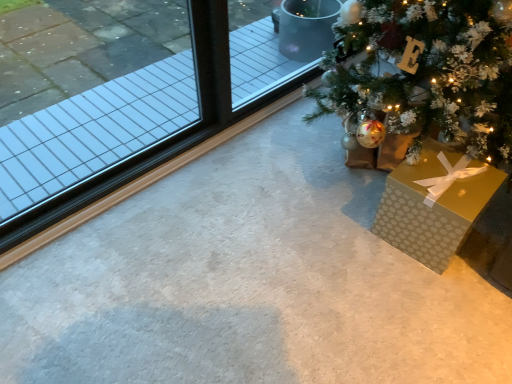
Question: Does clear glass window at left have a smaller size compared to gold paper gift at lower right?

Choices:
 (A) no
 (B) yes

Answer: (A)

Question: From a real-world perspective, is clear glass window at left under gold paper gift at lower right?

Choices:
 (A) yes
 (B) no

Answer: (B)

Question: Considering the relative positions of clear glass window at left and gold paper gift at lower right in the image provided, is clear glass window at left behind gold paper gift at lower right?

Choices:
 (A) no
 (B) yes

Answer: (A)

Question: Would you say clear glass window at left is a long distance from gold paper gift at lower right?

Choices:
 (A) yes
 (B) no

Answer: (A)

Question: Is clear glass window at left turned away from gold paper gift at lower right?

Choices:
 (A) no
 (B) yes

Answer: (A)

Question: Can you confirm if clear glass window at left is bigger than gold paper gift at lower right?

Choices:
 (A) yes
 (B) no

Answer: (A)

Question: Is the position of gold paper gift at lower right more distant than that of clear glass window at left?

Choices:
 (A) yes
 (B) no

Answer: (A)

Question: Does gold paper gift at lower right have a lesser width compared to clear glass window at left?

Choices:
 (A) yes
 (B) no

Answer: (B)

Question: From the image's perspective, is gold paper gift at lower right on top of clear glass window at left?

Choices:
 (A) yes
 (B) no

Answer: (B)

Question: Does gold paper gift at lower right have a lesser height compared to clear glass window at left?

Choices:
 (A) yes
 (B) no

Answer: (A)

Question: Is gold paper gift at lower right placed right next to clear glass window at left?

Choices:
 (A) yes
 (B) no

Answer: (B)

Question: Is gold paper gift at lower right oriented towards clear glass window at left?

Choices:
 (A) yes
 (B) no

Answer: (B)

Question: Looking at their shapes, would you say gold paper gift at lower right is wider or thinner than clear glass window at left?

Choices:
 (A) thin
 (B) wide

Answer: (B)